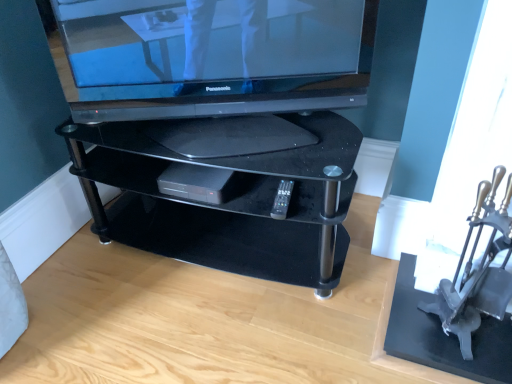
Question: Considering the relative sizes of black glass tv stand at center and metallic silver armchair at right in the image provided, is black glass tv stand at center smaller than metallic silver armchair at right?

Choices:
 (A) no
 (B) yes

Answer: (A)

Question: Does black glass tv stand at center lie in front of metallic silver armchair at right?

Choices:
 (A) yes
 (B) no

Answer: (B)

Question: Is black glass tv stand at center next to metallic silver armchair at right and touching it?

Choices:
 (A) no
 (B) yes

Answer: (A)

Question: Does black glass tv stand at center have a lesser height compared to metallic silver armchair at right?

Choices:
 (A) no
 (B) yes

Answer: (B)

Question: Could you tell me if black glass tv stand at center is facing metallic silver armchair at right?

Choices:
 (A) no
 (B) yes

Answer: (A)

Question: Is black glass tv stand at center not close to metallic silver armchair at right?

Choices:
 (A) no
 (B) yes

Answer: (A)

Question: Is metallic silver armchair at right looking in the opposite direction of satin black television at upper center?

Choices:
 (A) no
 (B) yes

Answer: (A)

Question: Considering the relative sizes of metallic silver armchair at right and satin black television at upper center in the image provided, is metallic silver armchair at right taller than satin black television at upper center?

Choices:
 (A) yes
 (B) no

Answer: (A)

Question: Is metallic silver armchair at right to the right of satin black television at upper center from the viewer's perspective?

Choices:
 (A) yes
 (B) no

Answer: (A)

Question: Can you confirm if metallic silver armchair at right is positioned to the left of satin black television at upper center?

Choices:
 (A) no
 (B) yes

Answer: (A)

Question: Does metallic silver armchair at right lie in front of satin black television at upper center?

Choices:
 (A) no
 (B) yes

Answer: (B)

Question: Does metallic silver armchair at right come behind satin black television at upper center?

Choices:
 (A) no
 (B) yes

Answer: (A)

Question: Is black glass tv stand at center far away from satin black television at upper center?

Choices:
 (A) yes
 (B) no

Answer: (B)